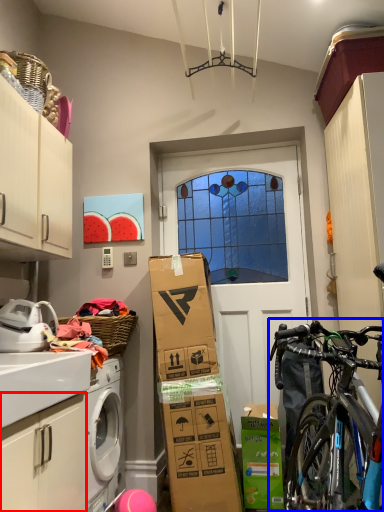
Question: Which of the following is the closest to the observer, cabinetry (highlighted by a red box) or bicycle (highlighted by a blue box)?

Choices:
 (A) cabinetry
 (B) bicycle

Answer: (A)